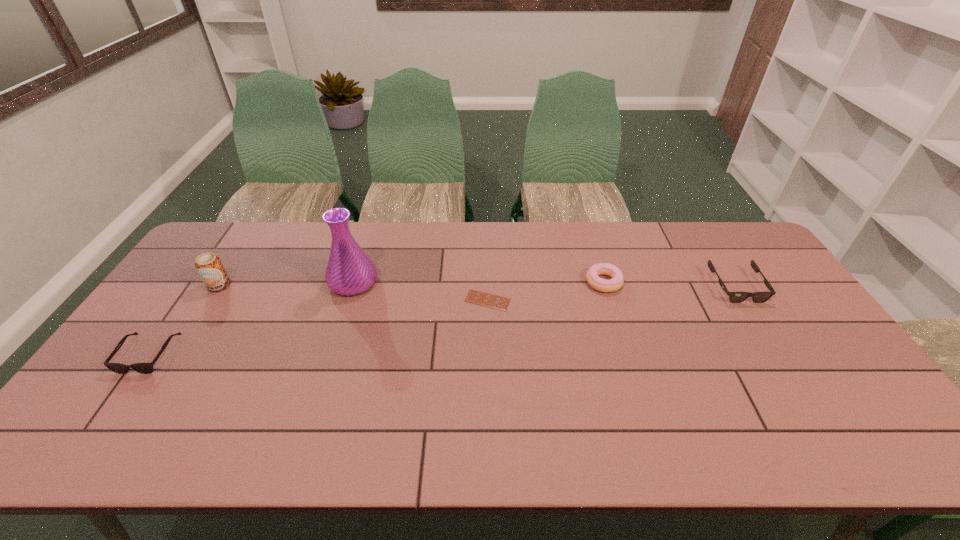
What are the coordinates of `unoccupied area between the nearer sunglasses and the vase` in the screenshot? It's located at [251, 319].

Locate an element on the screen. free space between the third object from left to right and the farther sunglasses is located at coordinates (544, 285).

Select which object appears as the closest to the nearer sunglasses. Please provide its 2D coordinates. Your answer should be formatted as a tuple, i.e. [(x, y)], where the tuple contains the x and y coordinates of a point satisfying the conditions above.

[(209, 266)]

Identify which object is the third closest to the vase. Please provide its 2D coordinates. Your answer should be formatted as a tuple, i.e. [(x, y)], where the tuple contains the x and y coordinates of a point satisfying the conditions above.

[(144, 368)]

Where is `free space that satisfies the following two spatial constraints: 1. on the front side of the beer can; 2. on the left side of the shortest object`? This screenshot has height=540, width=960. free space that satisfies the following two spatial constraints: 1. on the front side of the beer can; 2. on the left side of the shortest object is located at coordinates (210, 300).